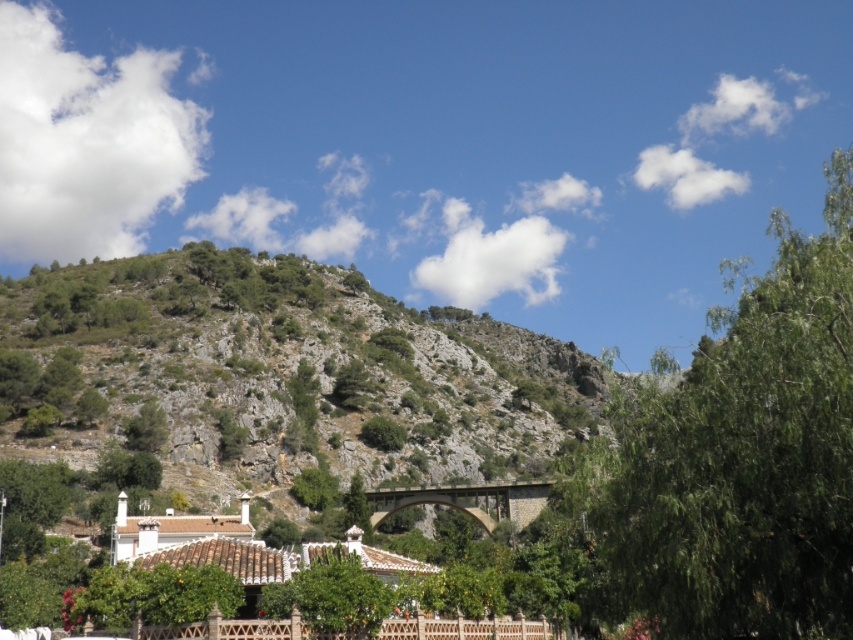
Consider the image. You are an architect designing a new garden path that must avoid the green leafy tree at upper right. Based on the coordinates provided, where should you place the path to ensure it doesn not interfere with the tree?

The green leafy tree at upper right is located at coordinates point (x=740, y=458). To avoid it, the garden path should be placed away from this position, ensuring a safe distance from the tree.

You are an environmental scientist assessing the landscape. You need to determine which tree is taller between the green leafy tree at upper right and the green leafy tree at center. Based on the scene, which one is taller?

The green leafy tree at upper right is taller than the green leafy tree at center.